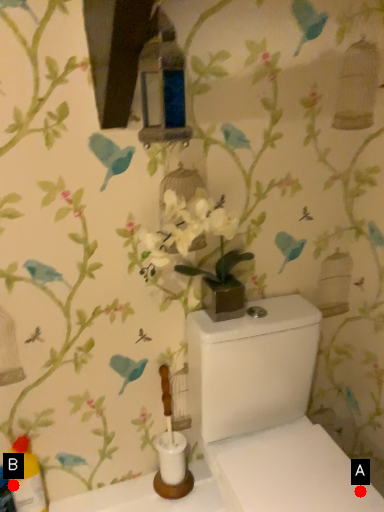
Question: Two points are circled on the image, labeled by A and B beside each circle. Among these points, which one is nearest to the camera?

Choices:
 (A) A is closer
 (B) B is closer

Answer: (A)